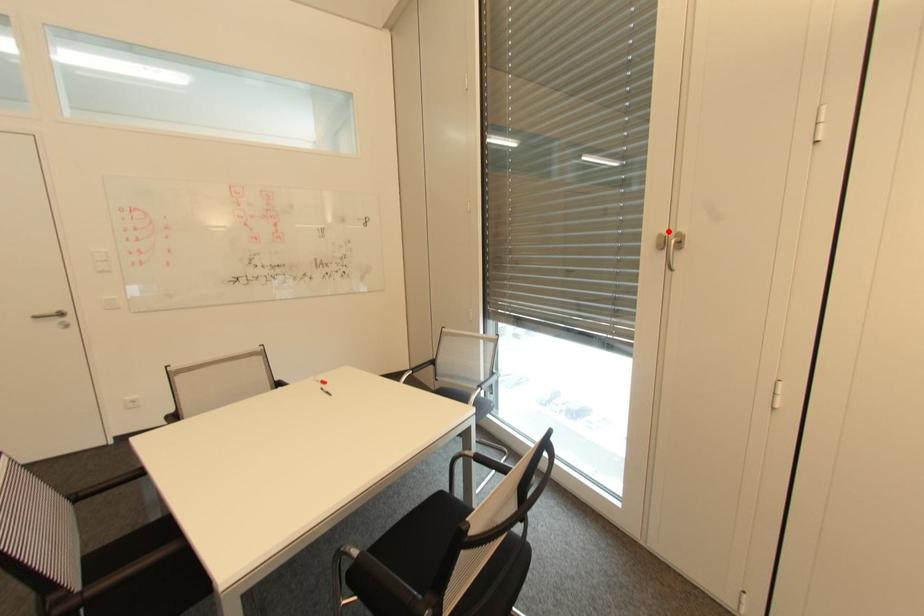
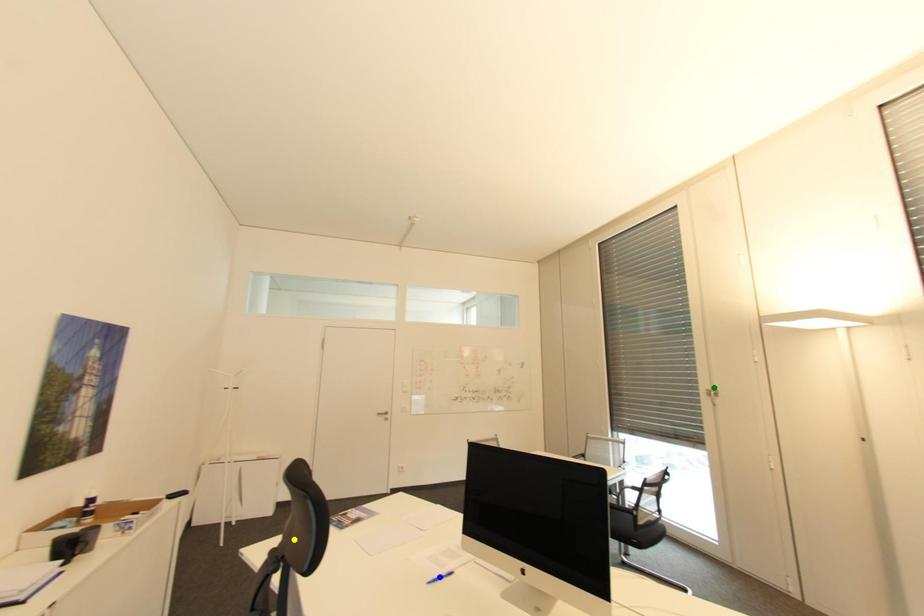
Question: I am providing you with two images of the same scene from different viewpoints. A red point is marked on the first image. You are given multiple points on the second image. Which point in image 2 represents the same 3d spot as the red point in image 1?

Choices:
 (A) yellow point
 (B) blue point
 (C) green point

Answer: (C)